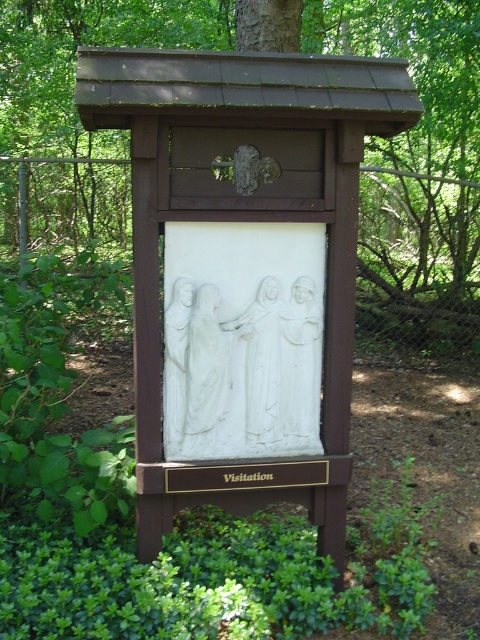
You are standing in front of the plaque and want to place a small flower bouquet between the brown wood tree at center and the white marble statue at center. Which object should you place the bouquet closer to if you want it to be closer to the left side of the plaque?

You should place the bouquet closer to the white marble statue at center because the brown wood tree at center is on its right side, so the statue is nearer to the left.